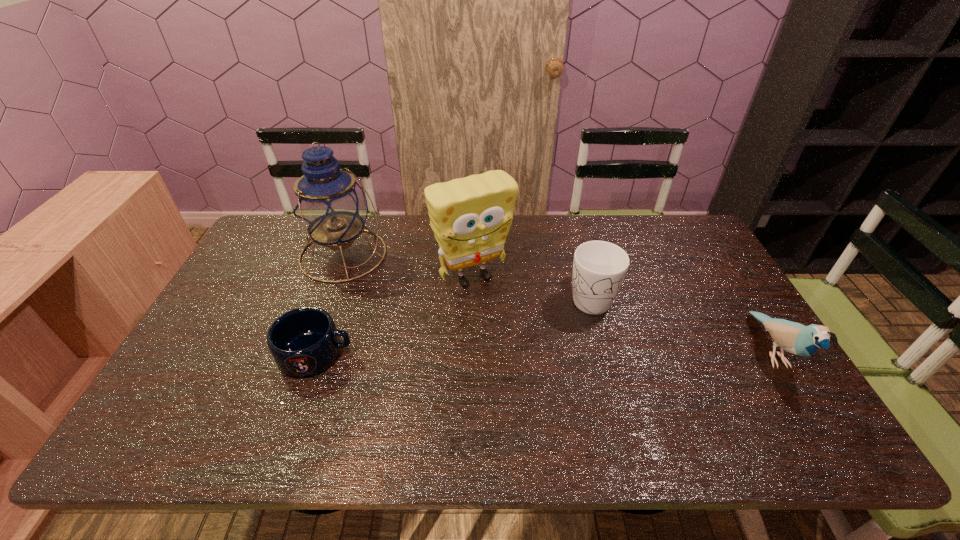
The height and width of the screenshot is (540, 960). I want to click on vacant point located 0.160m on the front-facing side of the tallest object, so click(x=405, y=296).

Where is `vacant space located on the front-facing side of the tallest object`? The height and width of the screenshot is (540, 960). vacant space located on the front-facing side of the tallest object is located at coordinates (385, 282).

I want to click on vacant space located on the face of the third object from right to left, so click(552, 383).

What are the coordinates of `vacant region located 0.190m on the face of the third object from right to left` in the screenshot? It's located at (522, 341).

You are a GUI agent. You are given a task and a screenshot of the screen. Output one action in this format:
    pyautogui.click(x=<x>, y=<y>)
    Task: Click on the blank space located on the face of the third object from right to left
    This screenshot has height=540, width=960.
    Given the screenshot: What is the action you would take?
    pyautogui.click(x=528, y=348)

Locate an element on the screen. vacant position located 0.230m on the side of the fourth object from left to right with the handle is located at coordinates (626, 390).

Find the location of a particular element. vacant space located on the side of the fourth object from left to right with the handle is located at coordinates (614, 360).

Find the location of `free space located 0.100m on the side of the fourth object from left to right with the handle`. free space located 0.100m on the side of the fourth object from left to right with the handle is located at coordinates (610, 348).

What are the coordinates of `object present at the far edge` in the screenshot? It's located at (329, 204).

Find the location of `mug that is at the near edge`. mug that is at the near edge is located at coordinates (305, 341).